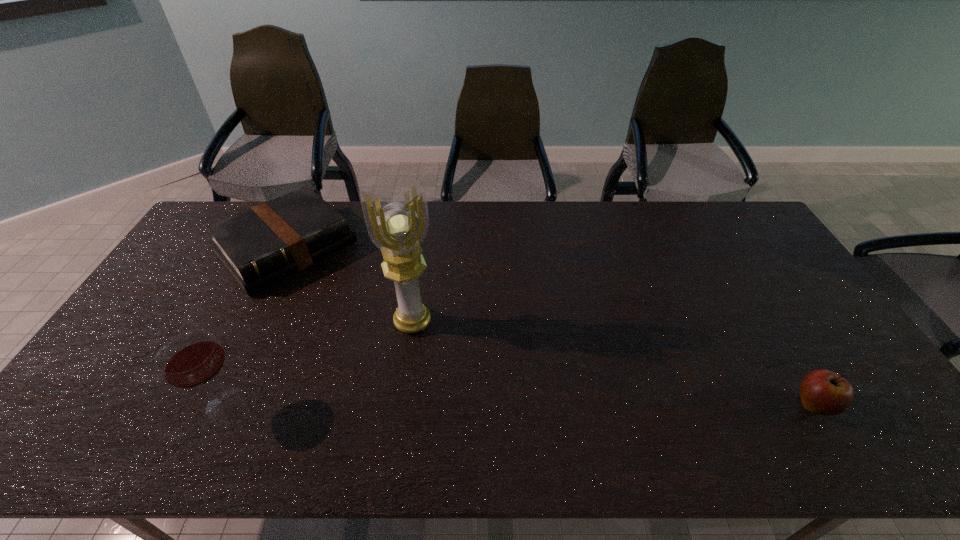
The width and height of the screenshot is (960, 540). Find the location of `object present at the far left corner`. object present at the far left corner is located at coordinates (260, 246).

At what (x,y) coordinates should I click in order to perform the action: click on object positioned at the near right corner. Please return your answer as a coordinate pair (x, y). This screenshot has height=540, width=960. Looking at the image, I should click on (823, 392).

In the image, there is a desktop. Where is `vacant space at the far edge`? vacant space at the far edge is located at coordinates (463, 225).

What are the coordinates of `vacant space at the near edge of the desktop` in the screenshot? It's located at (358, 387).

Locate an element on the screen. free region at the left edge is located at coordinates (184, 285).

Identify the location of free space at the far left corner. (244, 206).

The height and width of the screenshot is (540, 960). I want to click on vacant area at the far right corner, so click(730, 237).

The width and height of the screenshot is (960, 540). Find the location of `free area in between the farthest object and the second shortest object`. free area in between the farthest object and the second shortest object is located at coordinates tap(549, 327).

The image size is (960, 540). I want to click on vacant space that's between the third object from left to right and the wineglass, so click(319, 363).

In order to click on empty space that is in between the hardback book and the rightmost object in this screenshot , I will do `click(549, 327)`.